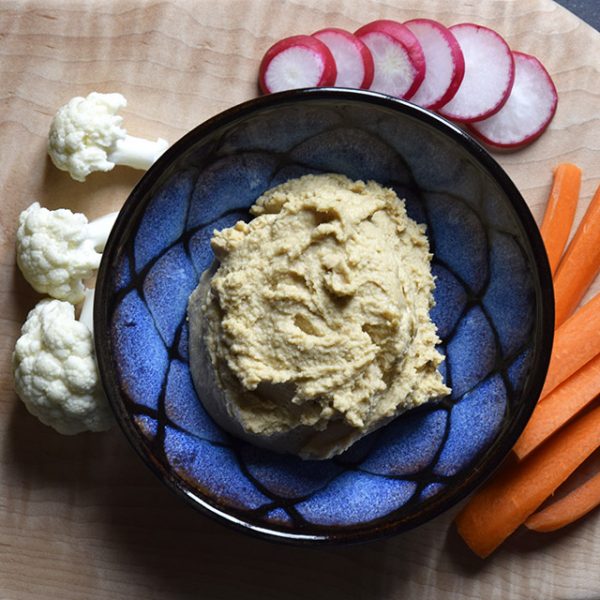
In order to click on bowl in this screenshot , I will do `click(165, 333)`.